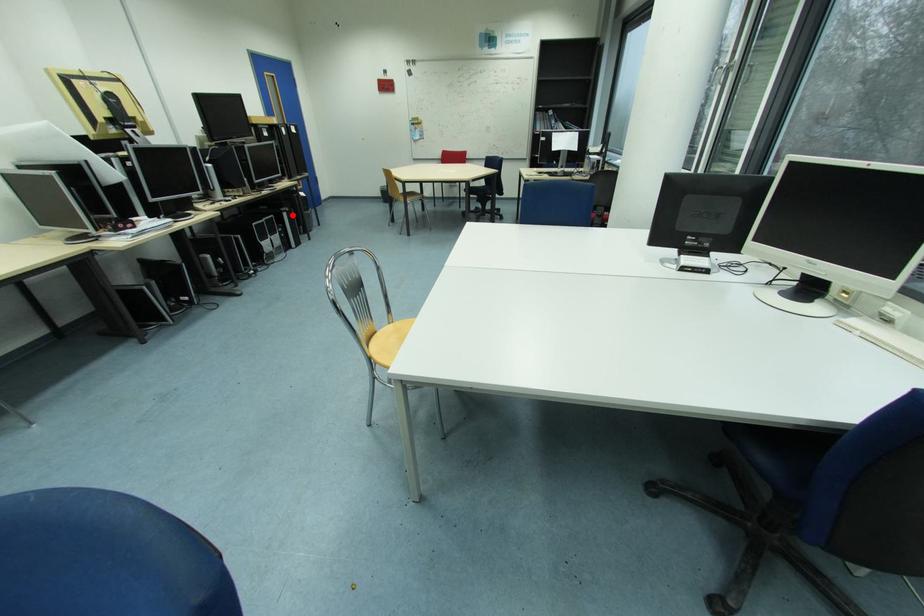
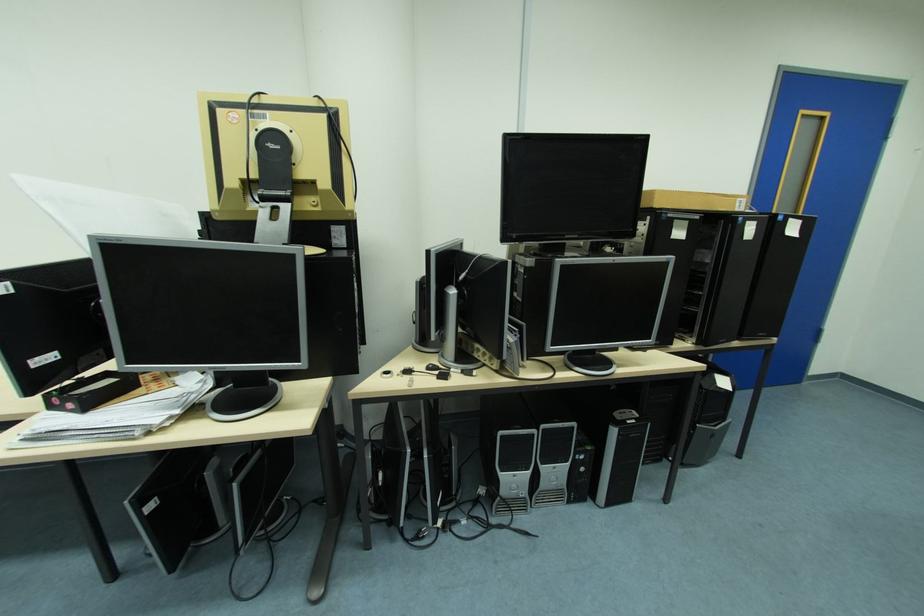
The point at the highlighted location is marked in the first image. Where is the corresponding point in the second image?

(621, 432)